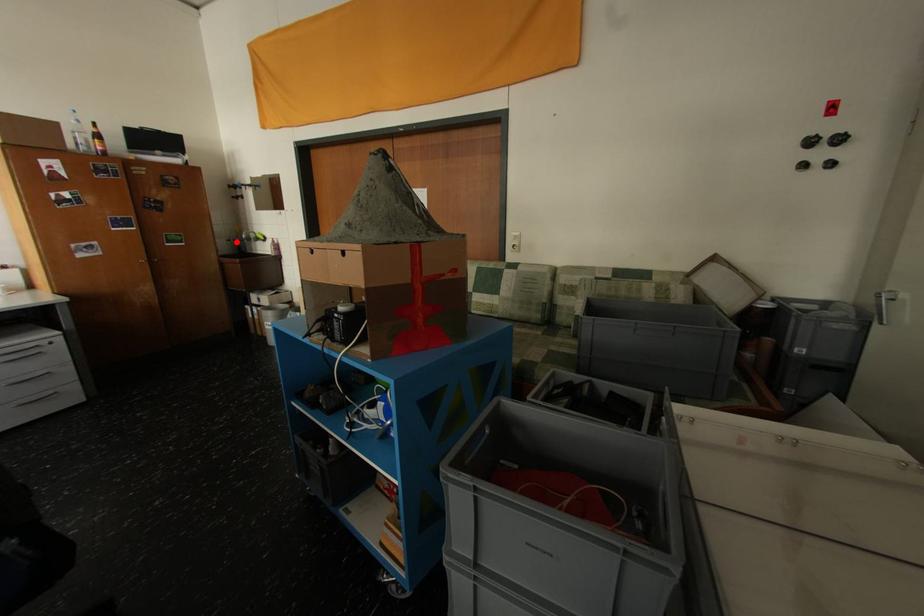
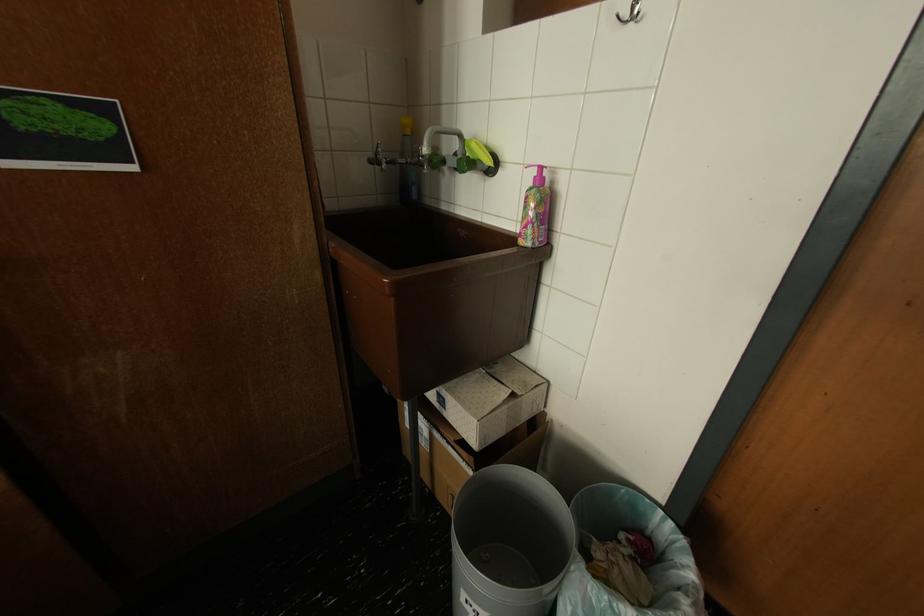
Locate, in the second image, the point that corresponds to the highlighted location in the first image.

(379, 163)